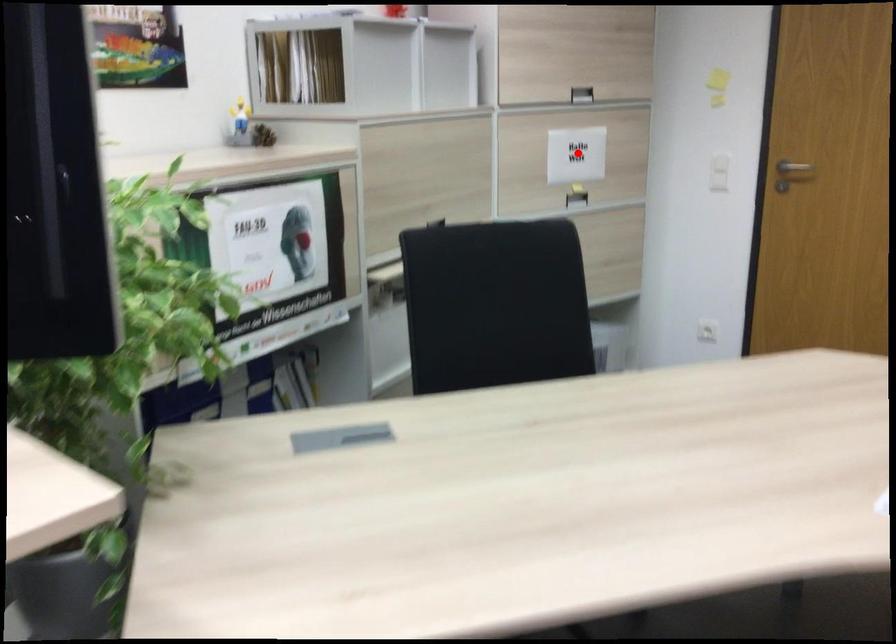
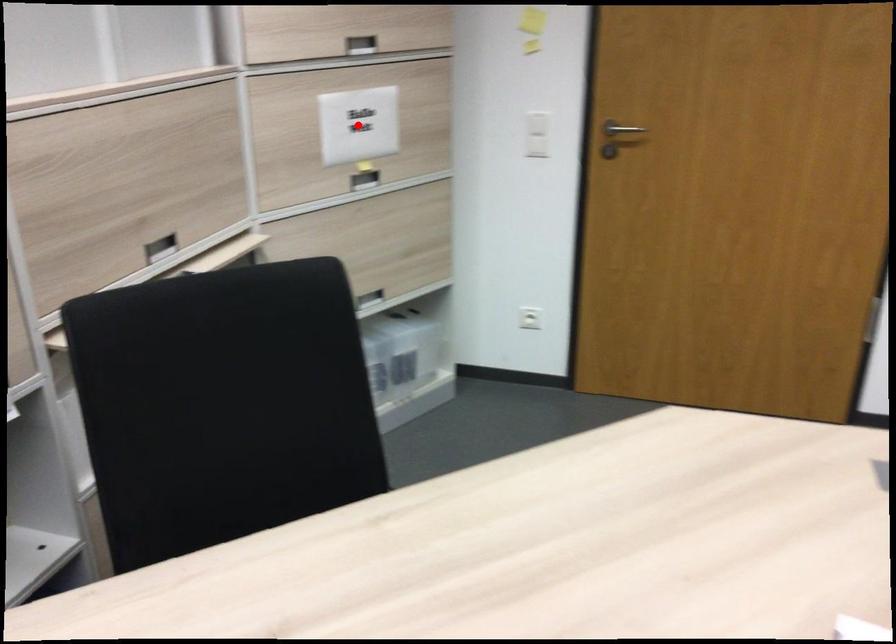
I am providing you with two images of the same scene from different viewpoints. A red point is marked on the first image and another point is marked on the second image. Is the marked point in image1 the same physical position as the marked point in image2?

Yes